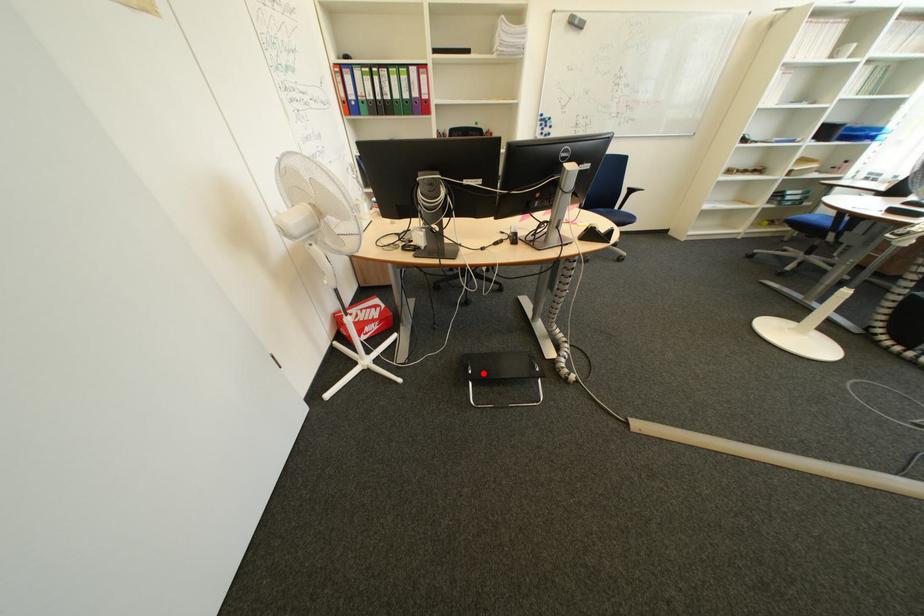
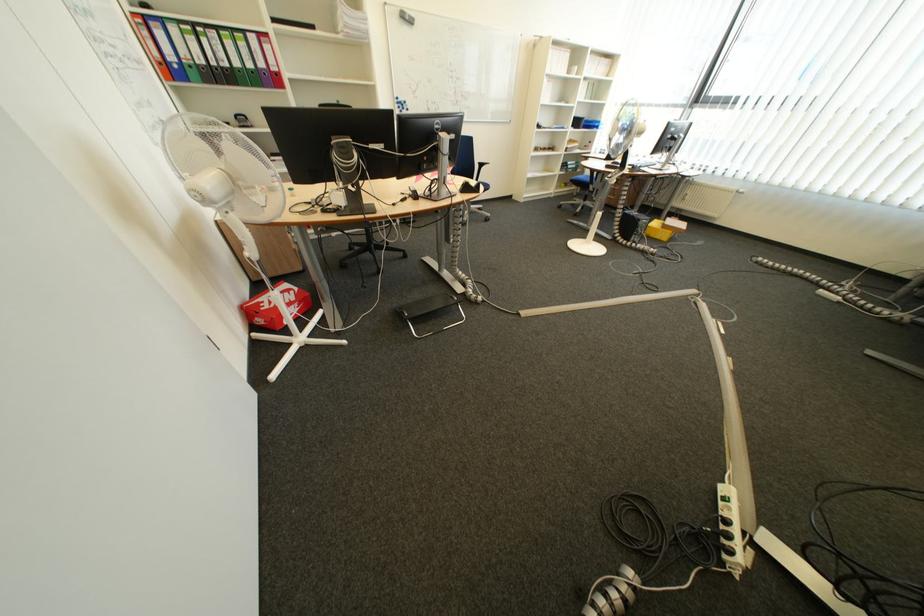
Question: I am providing you with two images of the same scene from different viewpoints. In image1, a red point is highlighted. Considering the same 3D point in image2, which of the following is correct?

Choices:
 (A) It is closer
 (B) It is farther

Answer: (A)